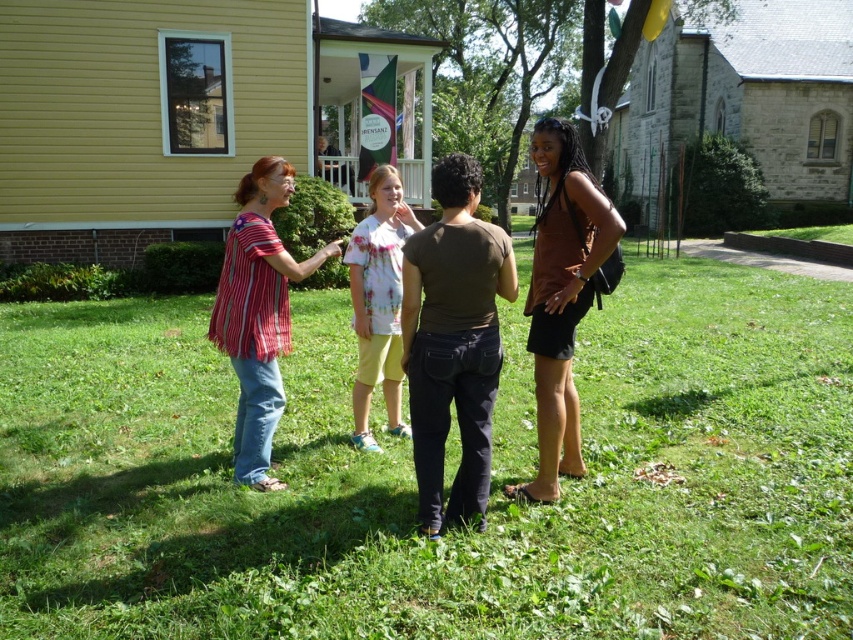
Is brown matte tank top at right below floral t-shirt at center?

Incorrect, brown matte tank top at right is not positioned below floral t-shirt at center.

Does brown matte tank top at right have a greater height compared to floral t-shirt at center?

Yes, brown matte tank top at right is taller than floral t-shirt at center.

In order to click on brown matte tank top at right in this screenshot , I will do click(561, 294).

Does point (540, 452) come behind point (270, 285)?

No, (540, 452) is in front of (270, 285).

Does point (546, 300) lie in front of point (259, 344)?

Yes, point (546, 300) is in front of point (259, 344).

Is point (546, 284) positioned behind point (259, 276)?

No, (546, 284) is in front of (259, 276).

You are a GUI agent. You are given a task and a screenshot of the screen. Output one action in this format:
    pyautogui.click(x=<x>, y=<y>)
    Task: Click on the brown matte tank top at right
    
    Given the screenshot: What is the action you would take?
    pyautogui.click(x=561, y=294)

Can you confirm if green grass at center is shorter than brown matte tank top at right?

Correct, green grass at center is not as tall as brown matte tank top at right.

Based on the photo, does green grass at center have a smaller size compared to brown matte tank top at right?

Yes, green grass at center is smaller than brown matte tank top at right.

Is point (340, 480) positioned before point (567, 397)?

Yes, it is.

Locate an element on the screen. The height and width of the screenshot is (640, 853). green grass at center is located at coordinates (415, 483).